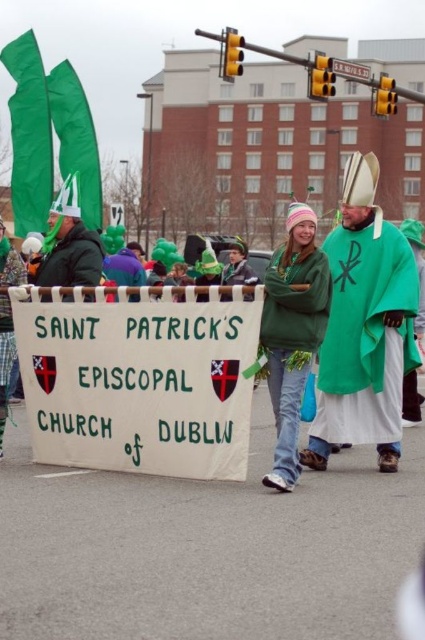
Who is lower down, green fabric cape at center or green fleece sweater at center?

green fleece sweater at center is below.

Who is taller, green fabric cape at center or green fleece sweater at center?

green fabric cape at center

Find the location of a particular element. green fabric cape at center is located at coordinates (365, 326).

Can you confirm if white paper banner at center is wider than green fabric cape at center?

Yes.

Between white paper banner at center and green fabric cape at center, which one appears on the left side from the viewer's perspective?

white paper banner at center

Is point (110, 448) more distant than point (357, 240)?

That is False.

Find the location of `white paper banner at center`. white paper banner at center is located at coordinates tap(138, 378).

Does white paper banner at center lie behind green fleece sweater at center?

Yes, it is.

Who is lower down, white paper banner at center or green fleece sweater at center?

Positioned lower is green fleece sweater at center.

Is point (61, 340) closer to camera compared to point (317, 298)?

No, it is behind (317, 298).

You are a GUI agent. You are given a task and a screenshot of the screen. Output one action in this format:
    pyautogui.click(x=<x>, y=<y>)
    Task: Click on the white paper banner at center
    
    Given the screenshot: What is the action you would take?
    pyautogui.click(x=138, y=378)